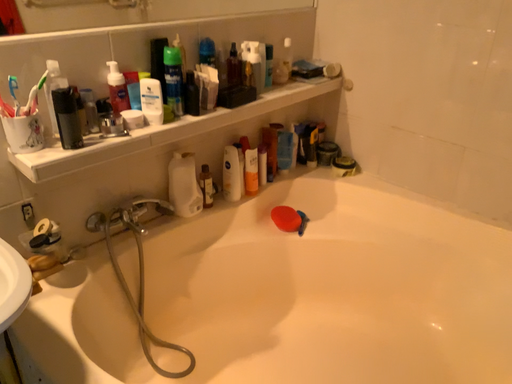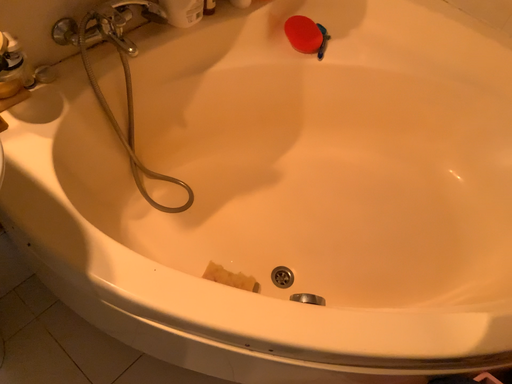
Question: How did the camera likely rotate when shooting the video?

Choices:
 (A) rotated downward
 (B) rotated upward

Answer: (A)